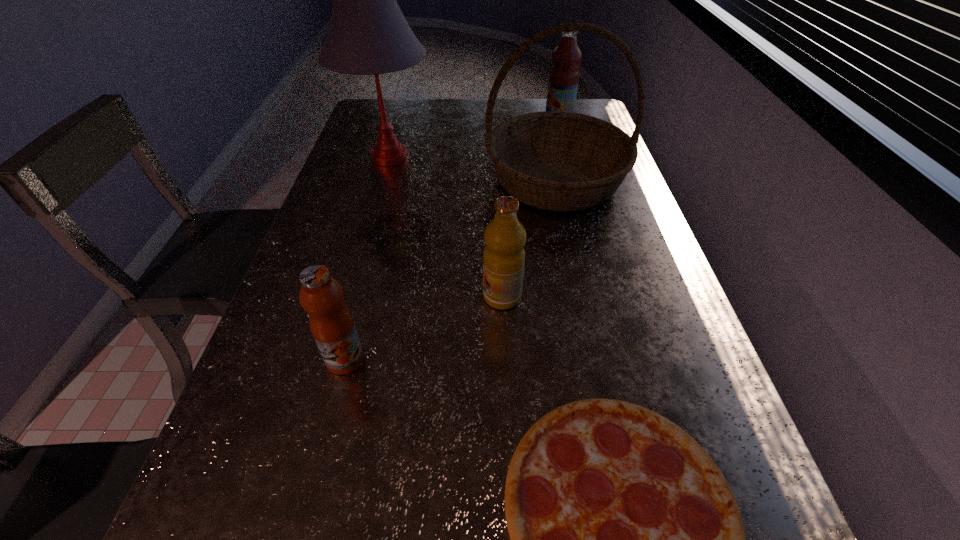
This screenshot has width=960, height=540. What are the coordinates of `vacant point located 0.220m on the front label of the rightmost fruit juice` in the screenshot? It's located at (483, 117).

Identify the location of free region located 0.330m on the front label of the rightmost fruit juice. (452, 117).

Identify the location of vacant space located 0.360m on the front label of the rightmost fruit juice. (444, 117).

Where is `vacant space located on the front label of the second fruit juice from right to left`? vacant space located on the front label of the second fruit juice from right to left is located at coordinates (445, 296).

You are a GUI agent. You are given a task and a screenshot of the screen. Output one action in this format:
    pyautogui.click(x=<x>, y=<y>)
    Task: Click on the vacant space located 0.380m on the front label of the second fruit juice from right to left
    
    Given the screenshot: What is the action you would take?
    pyautogui.click(x=307, y=296)

I want to click on free space located on the front label of the second fruit juice from right to left, so click(x=349, y=296).

Find the location of a particular element. The width and height of the screenshot is (960, 540). free spot located 0.170m on the front label of the nearest fruit juice is located at coordinates (317, 469).

Where is `object at the far edge`? The height and width of the screenshot is (540, 960). object at the far edge is located at coordinates 564,75.

I want to click on table lamp that is at the left edge, so click(x=368, y=34).

Locate an element on the screen. fruit juice present at the left edge is located at coordinates (331, 323).